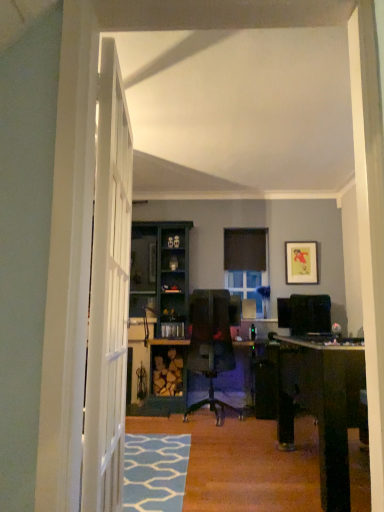
At what (x,y) coordinates should I click in order to perform the action: click on black matte curtain at center. Please return your answer as a coordinate pair (x, y). Looking at the image, I should click on (245, 249).

Measure the distance between yellow paper picture frame at upper right and camera.

yellow paper picture frame at upper right and camera are 5.58 meters apart from each other.

This screenshot has height=512, width=384. What do you see at coordinates (301, 263) in the screenshot?
I see `yellow paper picture frame at upper right` at bounding box center [301, 263].

This screenshot has height=512, width=384. What do you see at coordinates (246, 286) in the screenshot?
I see `clear glass window at center` at bounding box center [246, 286].

In order to face clear glass window at center, should I rotate leftwards or rightwards?

You should rotate right by 7.066 degrees.

This screenshot has width=384, height=512. Identify the location of black matte curtain at center. (245, 249).

Is yellow paper picture frame at upper right to the left of clear glass window at center from the viewer's perspective?

Incorrect, yellow paper picture frame at upper right is not on the left side of clear glass window at center.

From the image's perspective, does yellow paper picture frame at upper right appear lower than clear glass window at center?

Actually, yellow paper picture frame at upper right appears above clear glass window at center in the image.

Between yellow paper picture frame at upper right and clear glass window at center, which one has larger size?

With larger size is clear glass window at center.

Looking at this image, would you say yellow paper picture frame at upper right is inside or outside clear glass window at center?

yellow paper picture frame at upper right is spatially situated outside clear glass window at center.

Are clear glass window at center and black matte curtain at center beside each other?

No, clear glass window at center is not next to black matte curtain at center.

Considering their positions, is clear glass window at center located in front of or behind black matte curtain at center?

clear glass window at center is in front of black matte curtain at center.

Would you say clear glass window at center is inside or outside black matte curtain at center?

clear glass window at center is outside black matte curtain at center.

From the image's perspective, is clear glass window at center located above or below black matte curtain at center?

Based on their image positions, clear glass window at center is located beneath black matte curtain at center.

Looking at their sizes, would you say black matte curtain at center is wider or thinner than yellow paper picture frame at upper right?

Clearly, black matte curtain at center has more width compared to yellow paper picture frame at upper right.

Considering the points (251, 237) and (317, 276), which point is behind, point (251, 237) or point (317, 276)?

The point (251, 237) is farther from the camera.

Is black matte curtain at center shorter than yellow paper picture frame at upper right?

Indeed, black matte curtain at center has a lesser height compared to yellow paper picture frame at upper right.

Considering the relative positions of black matte curtain at center and yellow paper picture frame at upper right in the image provided, is black matte curtain at center to the left or to the right of yellow paper picture frame at upper right?

In the image, black matte curtain at center appears on the left side of yellow paper picture frame at upper right.

You are a GUI agent. You are given a task and a screenshot of the screen. Output one action in this format:
    pyautogui.click(x=<x>, y=<y>)
    Task: Click on the curtain above the yellow paper picture frame at upper right (from the image's perspective)
    This screenshot has height=512, width=384.
    Given the screenshot: What is the action you would take?
    pyautogui.click(x=245, y=249)

From a real-world perspective, which is physically below, yellow paper picture frame at upper right or black matte curtain at center?

In real-world perspective, yellow paper picture frame at upper right is lower.

Considering the points (316, 247) and (253, 239), which point is in front, point (316, 247) or point (253, 239)?

The point (316, 247) is in front.

In terms of height, does yellow paper picture frame at upper right look taller or shorter compared to black matte curtain at center?

In the image, yellow paper picture frame at upper right appears to be taller than black matte curtain at center.

Is clear glass window at center oriented away from yellow paper picture frame at upper right?

No.

Who is bigger, clear glass window at center or yellow paper picture frame at upper right?

clear glass window at center.

Where is `picture frame that is in front of the clear glass window at center`? This screenshot has height=512, width=384. picture frame that is in front of the clear glass window at center is located at coordinates (301, 263).

This screenshot has height=512, width=384. Identify the location of window below the black matte curtain at center (from the image's perspective). (246, 286).

Considering the points (247, 243) and (232, 293), which point is in front, point (247, 243) or point (232, 293)?

Positioned in front is point (232, 293).

Is black matte curtain at center bigger or smaller than clear glass window at center?

Clearly, black matte curtain at center is smaller in size than clear glass window at center.

From a real-world perspective, which object rests below the other?

In real-world perspective, clear glass window at center is lower.

Find the location of a particular element. The image size is (384, 512). picture frame in front of the clear glass window at center is located at coordinates (301, 263).

You are a GUI agent. You are given a task and a screenshot of the screen. Output one action in this format:
    pyautogui.click(x=<x>, y=<y>)
    Task: Click on the window below the black matte curtain at center (from the image's perspective)
    
    Given the screenshot: What is the action you would take?
    pyautogui.click(x=246, y=286)

Estimate the real-world distances between objects in this image. Which object is closer to clear glass window at center, yellow paper picture frame at upper right or black matte curtain at center?

black matte curtain at center.

Based on their spatial positions, is clear glass window at center or yellow paper picture frame at upper right further from black matte curtain at center?

yellow paper picture frame at upper right is positioned further to the anchor black matte curtain at center.

Looking at the image, which one is located closer to clear glass window at center, black matte curtain at center or yellow paper picture frame at upper right?

Among the two, black matte curtain at center is located nearer to clear glass window at center.

Estimate the real-world distances between objects in this image. Which object is closer to yellow paper picture frame at upper right, black matte curtain at center or clear glass window at center?

clear glass window at center is closer to yellow paper picture frame at upper right.

From the image, which object appears to be nearer to yellow paper picture frame at upper right, clear glass window at center or black matte curtain at center?

The object closer to yellow paper picture frame at upper right is clear glass window at center.

Estimate the real-world distances between objects in this image. Which object is further from black matte curtain at center, yellow paper picture frame at upper right or clear glass window at center?

yellow paper picture frame at upper right.

Identify the location of curtain situated between clear glass window at center and yellow paper picture frame at upper right from left to right. (245, 249).